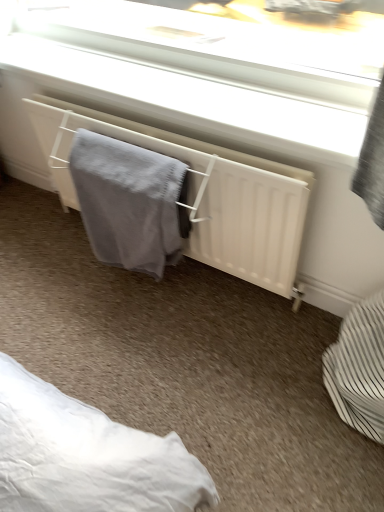
Identify the location of vacant space to the left of white striped basket at lower right. The height and width of the screenshot is (512, 384). (268, 386).